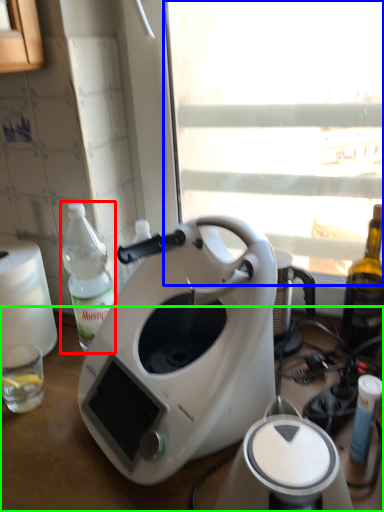
Question: Considering the real-world distances, which object is closest to bottle (highlighted by a red box)? window screen (highlighted by a blue box) or table (highlighted by a green box).

Choices:
 (A) window screen
 (B) table

Answer: (B)